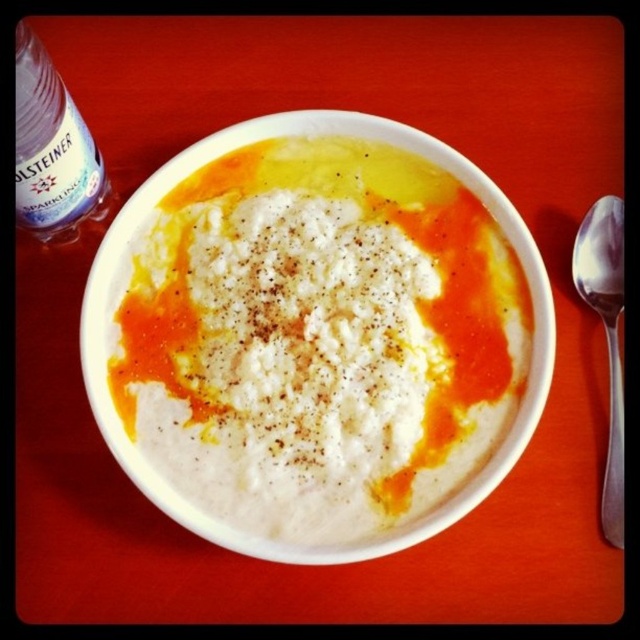
You are standing at point A and want to reach point B in the image. The coordinates for point A are point [620,244] and point B are point [332,384]. According to the spatial arrangement, can you directly walk from point A to point B without going through any objects?

Point [332,384] is behind point [620,244], so you cannot directly walk from point A to point B without going through objects.

You are a food critic analyzing the composition of the meal. Where is the white creamy soup at center located in the image?

The white creamy soup at center is located at the center of the image, precisely at the coordinates point (320, 337).